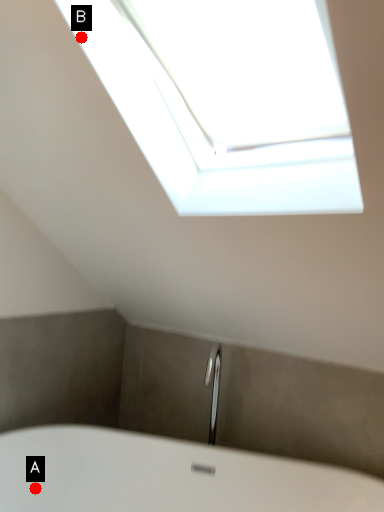
Question: Two points are circled on the image, labeled by A and B beside each circle. Which point is farther from the camera taking this photo?

Choices:
 (A) A is further
 (B) B is further

Answer: (A)